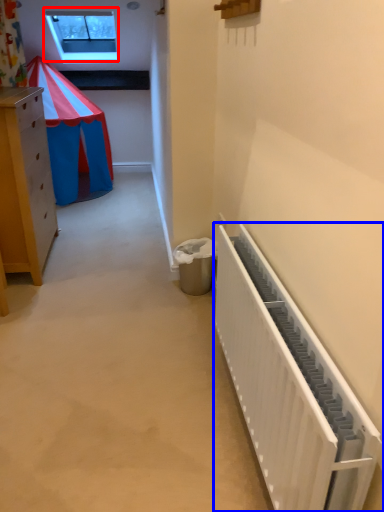
Question: Which object appears farthest to the camera in this image, window (highlighted by a red box) or radiator (highlighted by a blue box)?

Choices:
 (A) window
 (B) radiator

Answer: (A)